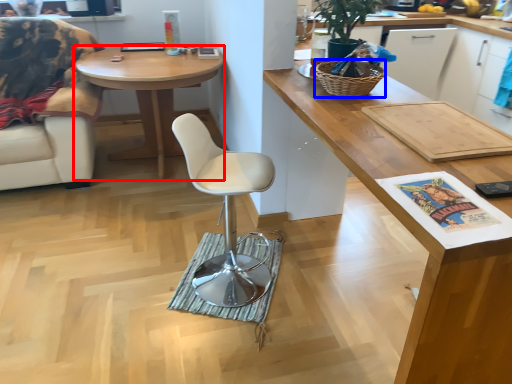
Question: Which object is further to the camera taking this photo, desk (highlighted by a red box) or picnic basket (highlighted by a blue box)?

Choices:
 (A) desk
 (B) picnic basket

Answer: (A)